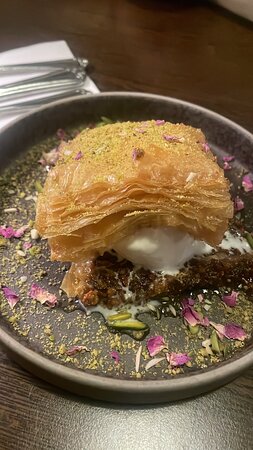
The width and height of the screenshot is (253, 450). I want to click on light, so [157, 435].